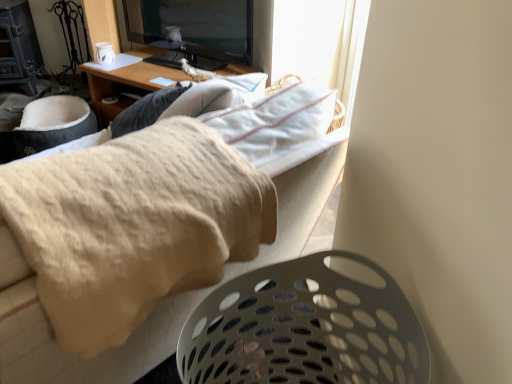
Question: In terms of height, does wooden desk at upper center look taller or shorter compared to white perforated laundry basket at lower right?

Choices:
 (A) short
 (B) tall

Answer: (A)

Question: Considering the positions of wooden desk at upper center and white perforated laundry basket at lower right in the image, is wooden desk at upper center wider or thinner than white perforated laundry basket at lower right?

Choices:
 (A) thin
 (B) wide

Answer: (B)

Question: Estimate the real-world distances between objects in this image. Which object is farther from the white perforated laundry basket at lower right?

Choices:
 (A) beige fabric couch at upper center
 (B) wooden desk at upper center

Answer: (B)

Question: Considering the real-world distances, which object is farthest from the beige fabric couch at upper center?

Choices:
 (A) white perforated laundry basket at lower right
 (B) wooden desk at upper center

Answer: (B)